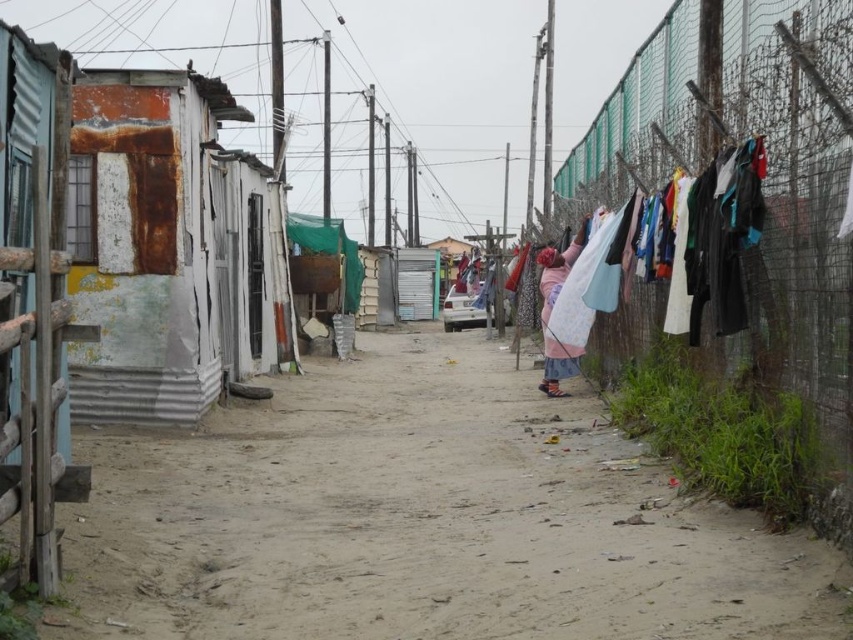
You are a delivery person trying to navigate through the alley. There is a rusty metal fence at right and a pink fabric at center. Can you pass through the space between them?

The rusty metal fence at right is located above the pink fabric at center, so there is enough vertical space to pass through the alley between them.

You are a delivery person with a cart that is 2 meters wide. You need to navigate through the narrow alleyway between the rusty metal hut at left and the pink fabric at center. Can your cart fit through the space between them?

The distance between the rusty metal hut at left and the pink fabric at center is 5.41 meters. Since your cart is only 2 meters wide, it can easily fit through the space between them as the distance is more than sufficient.

You are standing at the entrance of the alley and want to take a photo that includes both the point at coordinates (161, 346) and the point at coordinates (843, 150). Since you want to ensure both points are in focus, which point should you focus on to maximize the depth of field?

You should focus on the point at coordinates (843, 150) because it is closer to the camera than the point at coordinates (161, 346). Focusing on the closer object ensures that both it and the farther object will be within the depth of field.